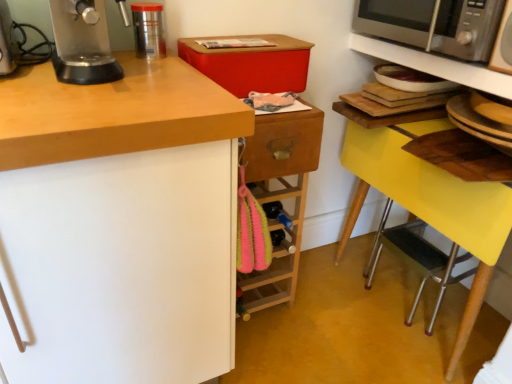
I want to click on free point above wooden drawer at center (from a real-world perspective), so click(282, 99).